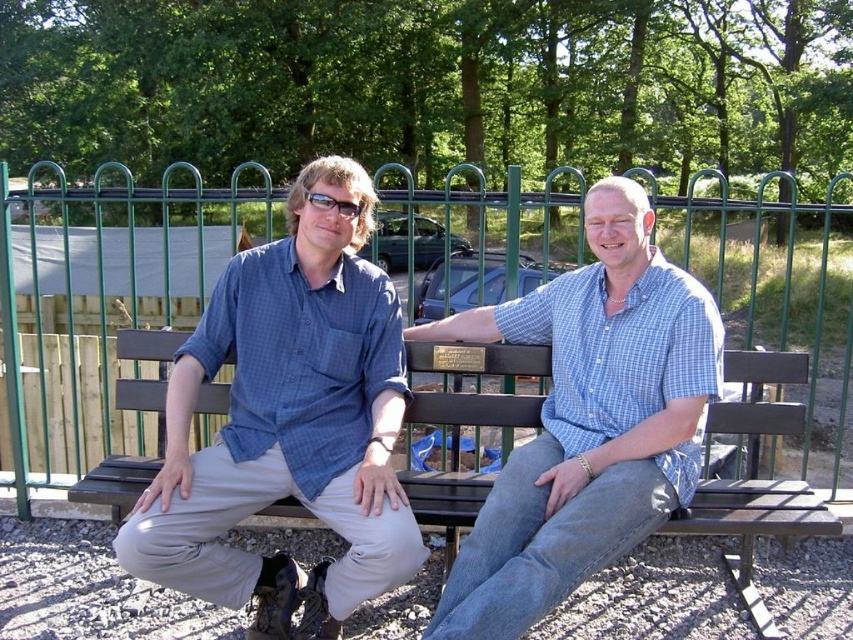
Question: Considering the real-world distances, which object is closest to the matte blue shirt at left?

Choices:
 (A) brown wooden bench at center
 (B) blue checkered shirt at center

Answer: (B)

Question: Based on their relative distances, which object is nearer to the brown wooden bench at center?

Choices:
 (A) matte black glasses at center
 (B) matte blue shirt at left
 (C) blue checkered shirt at center
 (D) green metal fence at upper center

Answer: (C)

Question: Which point is closer to the camera?

Choices:
 (A) (314, 202)
 (B) (582, 548)

Answer: (B)

Question: Is brown wooden bench at center positioned at the back of matte black glasses at center?

Choices:
 (A) yes
 (B) no

Answer: (B)

Question: Is blue checkered shirt at center further to camera compared to green metal fence at upper center?

Choices:
 (A) no
 (B) yes

Answer: (A)

Question: Can you confirm if matte blue shirt at left is positioned to the left of green metal fence at upper center?

Choices:
 (A) no
 (B) yes

Answer: (B)